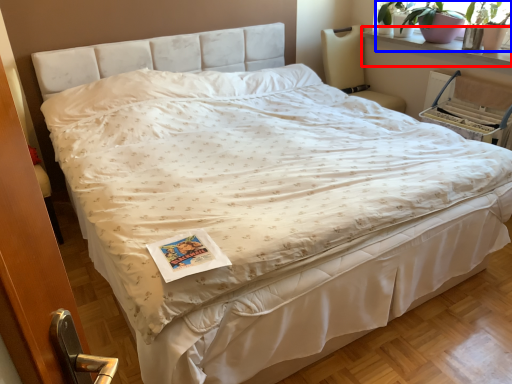
Question: Which point is further to the camera, window sill (highlighted by a red box) or plant (highlighted by a blue box)?

Choices:
 (A) window sill
 (B) plant

Answer: (B)